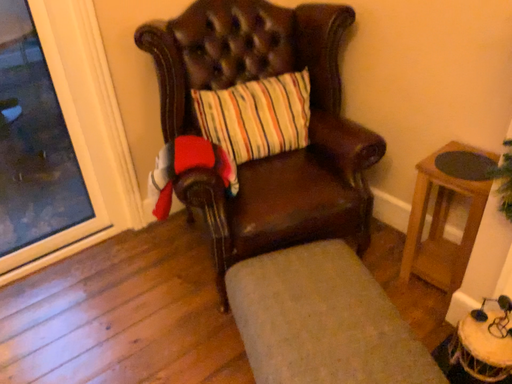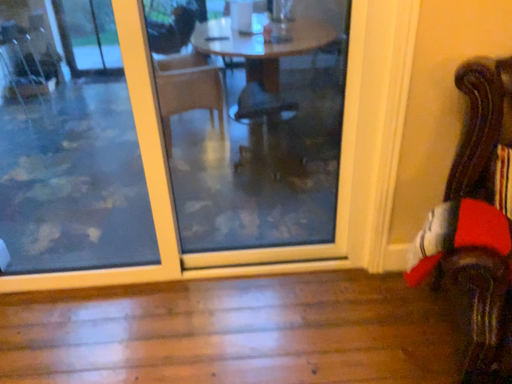
Question: Which way did the camera rotate in the video?

Choices:
 (A) rotated downward
 (B) rotated upward

Answer: (B)